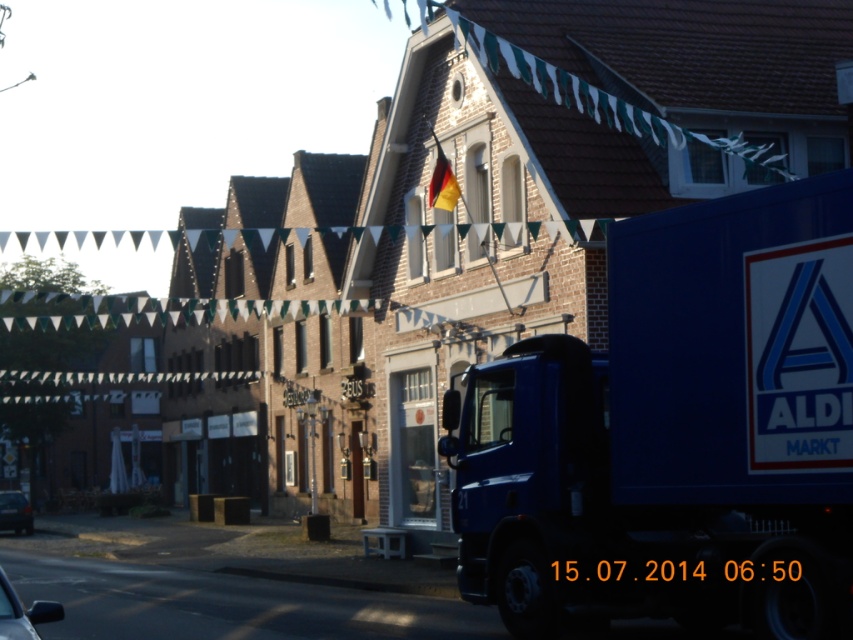
Question: Does shiny black car at lower left come in front of metallic silver car at lower left?

Choices:
 (A) no
 (B) yes

Answer: (B)

Question: Which point is closer to the camera?

Choices:
 (A) german flag at upper center
 (B) metallic silver car at lower left

Answer: (A)

Question: Is blue matte truck at center further to camera compared to metallic silver car at lower left?

Choices:
 (A) yes
 (B) no

Answer: (B)

Question: Considering the real-world distances, which object is closest to the blue matte truck at center?

Choices:
 (A) metallic silver car at lower left
 (B) german flag at upper center
 (C) shiny black car at lower left

Answer: (C)

Question: Does shiny black car at lower left have a larger size compared to german flag at upper center?

Choices:
 (A) yes
 (B) no

Answer: (A)

Question: Which object appears closest to the camera in this image?

Choices:
 (A) shiny black car at lower left
 (B) german flag at upper center
 (C) blue matte truck at center

Answer: (A)